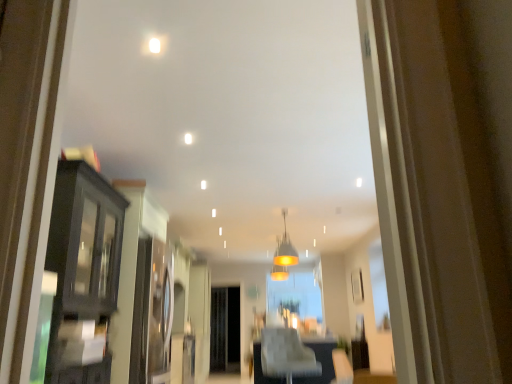
Locate an element on the screen. matte black cabinet at left is located at coordinates (82, 274).

Measure the distance between point (278,347) and camera.

4.45 meters.

The image size is (512, 384). Describe the element at coordinates (200, 317) in the screenshot. I see `clear glass door at center` at that location.

At what (x,y) coordinates should I click in order to perform the action: click on clear glass door at center. Please return your answer as a coordinate pair (x, y). This screenshot has height=384, width=512. Looking at the image, I should click on (200, 317).

You are a GUI agent. You are given a task and a screenshot of the screen. Output one action in this format:
    pyautogui.click(x=<x>, y=<y>)
    Task: Click on the matte black cabinet at left
    This screenshot has width=512, height=384.
    Given the screenshot: What is the action you would take?
    pyautogui.click(x=82, y=274)

Does matte black cabinet at left have a larger size compared to black mesh screen door at center?

Correct, matte black cabinet at left is larger in size than black mesh screen door at center.

In terms of height, does matte black cabinet at left look taller or shorter compared to black mesh screen door at center?

Clearly, matte black cabinet at left is taller compared to black mesh screen door at center.

Is the position of matte black cabinet at left more distant than that of black mesh screen door at center?

No.

Does matte black cabinet at left appear on the left side of black mesh screen door at center?

Correct, you'll find matte black cabinet at left to the left of black mesh screen door at center.

Considering the relative sizes of black mesh screen door at center and clear glass door at center in the image provided, is black mesh screen door at center thinner than clear glass door at center?

Yes, black mesh screen door at center is thinner than clear glass door at center.

Between black mesh screen door at center and clear glass door at center, which one has more height?

clear glass door at center is taller.

Looking at this image, is black mesh screen door at center to the left of clear glass door at center from the viewer's perspective?

No, black mesh screen door at center is not to the left of clear glass door at center.

Which is in front, black mesh screen door at center or clear glass door at center?

clear glass door at center is closer to the camera.

Which is behind, point (201, 266) or point (57, 286)?

Point (201, 266)

Find the location of a particular element. This screenshot has width=512, height=384. door lying below the matte black cabinet at left (from the image's perspective) is located at coordinates (200, 317).

From the picture: Is clear glass door at center smaller than matte black cabinet at left?

Actually, clear glass door at center might be larger than matte black cabinet at left.

Choose the correct answer: Is white leather chair at center inside matte glass pendant light at center or outside it?

white leather chair at center is not enclosed by matte glass pendant light at center.

Is white leather chair at center next to matte glass pendant light at center and touching it?

No, white leather chair at center is not in contact with matte glass pendant light at center.

The width and height of the screenshot is (512, 384). What are the coordinates of `furniture in front of the matte glass pendant light at center` in the screenshot? It's located at (287, 355).

Is matte black cabinet at left to the left or to the right of clear glass door at center in the image?

matte black cabinet at left is positioned on clear glass door at center's left side.

Does matte black cabinet at left have a greater height compared to clear glass door at center?

In fact, matte black cabinet at left may be shorter than clear glass door at center.

How different are the orientations of matte black cabinet at left and clear glass door at center in degrees?

They differ by 0.447 degrees in their facing directions.

Based on the photo, considering the sizes of matte black cabinet at left and white leather chair at center in the image, is matte black cabinet at left taller or shorter than white leather chair at center?

matte black cabinet at left is taller than white leather chair at center.

Is matte black cabinet at left positioned beyond the bounds of white leather chair at center?

Yes, matte black cabinet at left is not within white leather chair at center.

Is the surface of matte black cabinet at left in direct contact with white leather chair at center?

No, matte black cabinet at left is not with white leather chair at center.

From the image's perspective, is matte black cabinet at left under white leather chair at center?

No, from the image's perspective, matte black cabinet at left is not below white leather chair at center.

Considering the relative positions of white leather chair at center and black mesh screen door at center in the image provided, is white leather chair at center in front of black mesh screen door at center?

Yes, it is.

Measure the distance between white leather chair at center and black mesh screen door at center.

A distance of 4.50 meters exists between white leather chair at center and black mesh screen door at center.

Considering the relative sizes of white leather chair at center and black mesh screen door at center in the image provided, is white leather chair at center taller than black mesh screen door at center?

No.

Is white leather chair at center beside black mesh screen door at center?

white leather chair at center and black mesh screen door at center are clearly separated.

The width and height of the screenshot is (512, 384). In order to click on screen door that is below the matte black cabinet at left (from the image's perspective) in this screenshot , I will do `click(225, 330)`.

The width and height of the screenshot is (512, 384). I want to click on screen door that is on the right side of clear glass door at center, so click(225, 330).

Estimate the real-world distances between objects in this image. Which object is further from matte glass pendant light at center, clear glass door at center or white leather chair at center?

Based on the image, white leather chair at center appears to be further to matte glass pendant light at center.

Which object lies further to the anchor point clear glass door at center, matte black cabinet at left or matte glass pendant light at center?

Among the two, matte black cabinet at left is located further to clear glass door at center.

Consider the image. Considering their positions, is white leather chair at center positioned closer to clear glass door at center than black mesh screen door at center?

black mesh screen door at center lies closer to clear glass door at center than the other object.

Looking at this image, which object lies nearer to the anchor point clear glass door at center, black mesh screen door at center or matte black cabinet at left?

black mesh screen door at center.

When comparing their distances from matte glass pendant light at center, does clear glass door at center or matte black cabinet at left seem closer?

Among the two, clear glass door at center is located nearer to matte glass pendant light at center.

Looking at the image, which one is located further to matte black cabinet at left, matte glass pendant light at center or white leather chair at center?

matte glass pendant light at center.

Which object lies nearer to the anchor point matte black cabinet at left, matte glass pendant light at center or black mesh screen door at center?

matte glass pendant light at center lies closer to matte black cabinet at left than the other object.

From the picture: Estimate the real-world distances between objects in this image. Which object is closer to black mesh screen door at center, white leather chair at center or clear glass door at center?

clear glass door at center.

Identify the location of light fixture located between matte black cabinet at left and clear glass door at center in the depth direction. The height and width of the screenshot is (384, 512). (285, 249).

You are a GUI agent. You are given a task and a screenshot of the screen. Output one action in this format:
    pyautogui.click(x=<x>, y=<y>)
    Task: Click on the light fixture positioned between white leather chair at center and black mesh screen door at center from near to far
    
    Given the screenshot: What is the action you would take?
    pyautogui.click(x=285, y=249)

In order to click on door located between matte black cabinet at left and black mesh screen door at center in the depth direction in this screenshot , I will do `click(200, 317)`.

Locate an element on the screen. furniture between matte black cabinet at left and clear glass door at center along the z-axis is located at coordinates (287, 355).